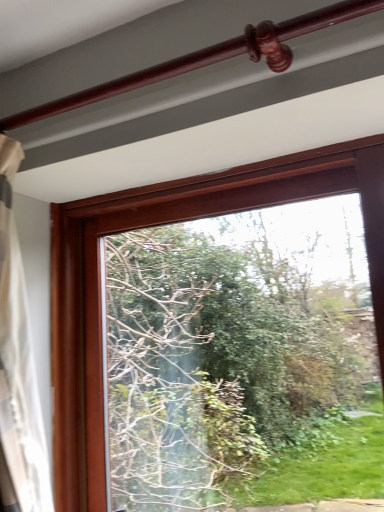
At what (x,y) coordinates should I click in order to perform the action: click on glossy wood rail at upper center. Please return your answer as a coordinate pair (x, y). Image resolution: width=384 pixels, height=512 pixels. Looking at the image, I should click on (208, 58).

The image size is (384, 512). What do you see at coordinates (208, 58) in the screenshot? I see `glossy wood rail at upper center` at bounding box center [208, 58].

The image size is (384, 512). What do you see at coordinates (167, 223) in the screenshot?
I see `transparent glass window at center` at bounding box center [167, 223].

At what (x,y) coordinates should I click in order to perform the action: click on transparent glass window at center. Please return your answer as a coordinate pair (x, y). This screenshot has width=384, height=512. Looking at the image, I should click on (167, 223).

Where is `glossy wood rail at upper center`? glossy wood rail at upper center is located at coordinates (208, 58).

Considering the relative positions of transparent glass window at center and glossy wood rail at upper center in the image provided, is transparent glass window at center to the left of glossy wood rail at upper center from the viewer's perspective?

No, transparent glass window at center is not to the left of glossy wood rail at upper center.

In the scene shown: Considering the positions of objects transparent glass window at center and glossy wood rail at upper center in the image provided, who is in front, transparent glass window at center or glossy wood rail at upper center?

glossy wood rail at upper center is in front.

Which is closer, (365, 178) or (192, 66)?

The point (192, 66) is closer.

From the image's perspective, is transparent glass window at center located beneath glossy wood rail at upper center?

Correct, transparent glass window at center appears lower than glossy wood rail at upper center in the image.

From a real-world perspective, is transparent glass window at center physically below glossy wood rail at upper center?

Correct, in the physical world, transparent glass window at center is lower than glossy wood rail at upper center.

Is transparent glass window at center thinner than glossy wood rail at upper center?

Incorrect, the width of transparent glass window at center is not less than that of glossy wood rail at upper center.

Considering the relative sizes of transparent glass window at center and glossy wood rail at upper center in the image provided, is transparent glass window at center taller than glossy wood rail at upper center?

Correct, transparent glass window at center is much taller as glossy wood rail at upper center.

In terms of size, does transparent glass window at center appear bigger or smaller than glossy wood rail at upper center?

In the image, transparent glass window at center appears to be larger than glossy wood rail at upper center.

Is transparent glass window at center located outside glossy wood rail at upper center?

transparent glass window at center is positioned outside glossy wood rail at upper center.

Is the surface of transparent glass window at center in direct contact with glossy wood rail at upper center?

No, transparent glass window at center is not with glossy wood rail at upper center.

Does transparent glass window at center turn towards glossy wood rail at upper center?

Yes, transparent glass window at center is oriented towards glossy wood rail at upper center.

Find the location of a particular element. The image size is (384, 512). window below the glossy wood rail at upper center (from the image's perspective) is located at coordinates (167, 223).

Considering the positions of objects glossy wood rail at upper center and transparent glass window at center in the image provided, who is more to the left, glossy wood rail at upper center or transparent glass window at center?

glossy wood rail at upper center is more to the left.

Relative to transparent glass window at center, is glossy wood rail at upper center in front or behind?

glossy wood rail at upper center is positioned closer to the viewer than transparent glass window at center.

Considering the points (240, 45) and (73, 315), which point is behind, point (240, 45) or point (73, 315)?

The point (73, 315) is behind.

From the image's perspective, would you say glossy wood rail at upper center is shown under transparent glass window at center?

No, from the image's perspective, glossy wood rail at upper center is not below transparent glass window at center.

From a real-world perspective, which is physically below, glossy wood rail at upper center or transparent glass window at center?

transparent glass window at center.

Between glossy wood rail at upper center and transparent glass window at center, which one has larger width?

transparent glass window at center is wider.

Considering the sizes of objects glossy wood rail at upper center and transparent glass window at center in the image provided, who is shorter, glossy wood rail at upper center or transparent glass window at center?

glossy wood rail at upper center is shorter.

Which of these two, glossy wood rail at upper center or transparent glass window at center, is bigger?

transparent glass window at center is bigger.

Is transparent glass window at center located within glossy wood rail at upper center?

No, transparent glass window at center is not surrounded by glossy wood rail at upper center.

Can you see glossy wood rail at upper center touching transparent glass window at center?

No, glossy wood rail at upper center is not in contact with transparent glass window at center.

Does glossy wood rail at upper center turn towards transparent glass window at center?

No, glossy wood rail at upper center is not oriented towards transparent glass window at center.

What's the angular difference between glossy wood rail at upper center and transparent glass window at center's facing directions?

glossy wood rail at upper center and transparent glass window at center are facing 0.789 degrees away from each other.

In the image, there is a glossy wood rail at upper center. Identify the location of window below it (from a real-world perspective). The width and height of the screenshot is (384, 512). (167, 223).

I want to click on window lying behind the glossy wood rail at upper center, so click(167, 223).

Locate an element on the screen. The width and height of the screenshot is (384, 512). rail in front of the transparent glass window at center is located at coordinates (208, 58).